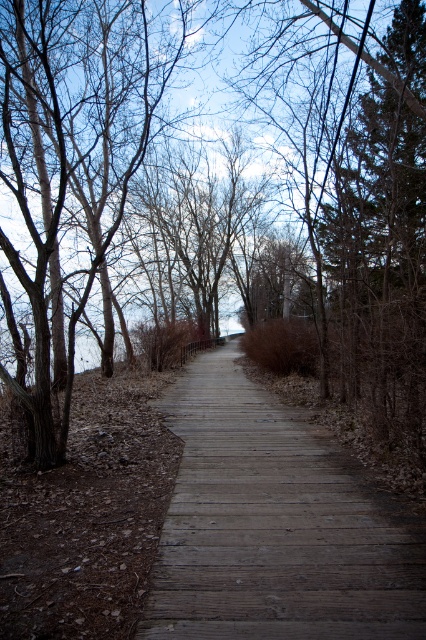
You are standing at the starting point of the boardwalk and want to reach a point that is closer to the horizon. Which point should you head towards, point [399,264] or point [172,611]?

You should head towards point [172,611] because it is closer to the horizon compared to point [399,264], which is nearer to you.

You are standing on the wooden boardwalk pathway in the image. There is a point marked at coordinates (215, 189). What object does this point correspond to?

The point corresponds to the brown wood tree at center.